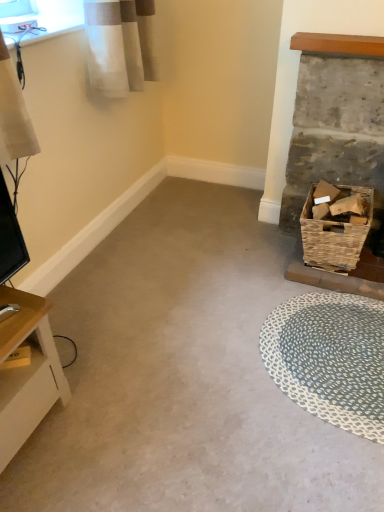
The height and width of the screenshot is (512, 384). I want to click on woven brown basket at right, so click(334, 234).

This screenshot has width=384, height=512. What do you see at coordinates (334, 234) in the screenshot?
I see `woven brown basket at right` at bounding box center [334, 234].

Describe the element at coordinates (337, 153) in the screenshot. I see `rustic wicker basket at right` at that location.

The image size is (384, 512). What are the coordinates of `woven brown basket at right` in the screenshot? It's located at (334, 234).

Which of these two, rustic wicker basket at right or light wood table at lower left, is wider?

Wider between the two is light wood table at lower left.

Who is smaller, rustic wicker basket at right or light wood table at lower left?

With smaller size is rustic wicker basket at right.

In the scene shown: Considering the relative positions of rustic wicker basket at right and light wood table at lower left in the image provided, is rustic wicker basket at right to the left or to the right of light wood table at lower left?

rustic wicker basket at right is positioned on light wood table at lower left's right side.

From the image's perspective, between rustic wicker basket at right and light wood table at lower left, who is located below?

light wood table at lower left appears lower in the image.

From the picture: Can we say woven brown basket at right lies outside blue woven mat at lower right?

Indeed, woven brown basket at right is completely outside blue woven mat at lower right.

Which is further, (368, 188) or (380, 393)?

Positioned behind is point (368, 188).

Considering the sizes of woven brown basket at right and blue woven mat at lower right in the image, is woven brown basket at right bigger or smaller than blue woven mat at lower right?

woven brown basket at right is bigger than blue woven mat at lower right.

Could you tell me if light wood table at lower left is facing rustic wicker basket at right?

No, light wood table at lower left is not turned towards rustic wicker basket at right.

Looking at their sizes, would you say light wood table at lower left is wider or thinner than rustic wicker basket at right?

Considering their sizes, light wood table at lower left looks broader than rustic wicker basket at right.

Considering the relative positions of light wood table at lower left and rustic wicker basket at right in the image provided, is light wood table at lower left to the right of rustic wicker basket at right from the viewer's perspective?

No.

Measure the distance from light wood table at lower left to rustic wicker basket at right.

light wood table at lower left is 1.31 meters from rustic wicker basket at right.

Considering the sizes of objects blue woven mat at lower right and woven brown basket at right in the image provided, who is wider, blue woven mat at lower right or woven brown basket at right?

Wider between the two is blue woven mat at lower right.

Between blue woven mat at lower right and woven brown basket at right, which one appears on the right side from the viewer's perspective?

Positioned to the right is woven brown basket at right.

Considering the relative sizes of blue woven mat at lower right and woven brown basket at right in the image provided, is blue woven mat at lower right shorter than woven brown basket at right?

Correct, blue woven mat at lower right is not as tall as woven brown basket at right.

Considering the relative positions of woven brown basket at right and light wood table at lower left in the image provided, is woven brown basket at right behind light wood table at lower left?

Yes, woven brown basket at right is further from the viewer.

From the image's perspective, who appears lower, woven brown basket at right or light wood table at lower left?

light wood table at lower left, from the image's perspective.

Considering the points (316, 222) and (33, 304), which point is behind, point (316, 222) or point (33, 304)?

The point (316, 222) is behind.

Does woven brown basket at right have a lesser width compared to light wood table at lower left?

Yes, woven brown basket at right is thinner than light wood table at lower left.

From the image's perspective, who appears lower, blue woven mat at lower right or light wood table at lower left?

light wood table at lower left, from the image's perspective.

Who is smaller, blue woven mat at lower right or light wood table at lower left?

Smaller between the two is blue woven mat at lower right.

Find the location of a particular element. table in front of the blue woven mat at lower right is located at coordinates (27, 372).

Is blue woven mat at lower right positioned far away from light wood table at lower left?

No, blue woven mat at lower right is not far away from light wood table at lower left.

From the image's perspective, relative to blue woven mat at lower right, is light wood table at lower left above or below?

Clearly, from the image's perspective, light wood table at lower left is below blue woven mat at lower right.

Considering the positions of point (33, 319) and point (344, 406), is point (33, 319) closer or farther from the camera than point (344, 406)?

Point (33, 319) is positioned closer to the camera compared to point (344, 406).

Considering the sizes of light wood table at lower left and blue woven mat at lower right in the image, is light wood table at lower left taller or shorter than blue woven mat at lower right?

light wood table at lower left is taller than blue woven mat at lower right.

Find the location of a particular element. This screenshot has height=512, width=384. fireplace behind the light wood table at lower left is located at coordinates (337, 153).

This screenshot has width=384, height=512. Find the location of `basket on the right of the blue woven mat at lower right`. basket on the right of the blue woven mat at lower right is located at coordinates (334, 234).

From the image, which object appears to be farther from woven brown basket at right, rustic wicker basket at right or blue woven mat at lower right?

blue woven mat at lower right is further to woven brown basket at right.

In the scene shown: Considering their positions, is light wood table at lower left positioned further to blue woven mat at lower right than woven brown basket at right?

light wood table at lower left lies further to blue woven mat at lower right than the other object.

Which object lies nearer to the anchor point rustic wicker basket at right, blue woven mat at lower right or light wood table at lower left?

Based on the image, blue woven mat at lower right appears to be nearer to rustic wicker basket at right.

In the scene shown: Based on their spatial positions, is rustic wicker basket at right or blue woven mat at lower right closer to light wood table at lower left?

Based on the image, blue woven mat at lower right appears to be nearer to light wood table at lower left.

From the image, which object appears to be nearer to rustic wicker basket at right, woven brown basket at right or light wood table at lower left?

woven brown basket at right lies closer to rustic wicker basket at right than the other object.

Based on their spatial positions, is blue woven mat at lower right or rustic wicker basket at right further from woven brown basket at right?

blue woven mat at lower right.

Estimate the real-world distances between objects in this image. Which object is further from rustic wicker basket at right, light wood table at lower left or woven brown basket at right?

light wood table at lower left.

Estimate the real-world distances between objects in this image. Which object is further from woven brown basket at right, light wood table at lower left or rustic wicker basket at right?

light wood table at lower left is positioned further to the anchor woven brown basket at right.

This screenshot has height=512, width=384. In order to click on basket between light wood table at lower left and rustic wicker basket at right in the horizontal direction in this screenshot , I will do `click(334, 234)`.

I want to click on mat situated between light wood table at lower left and rustic wicker basket at right from left to right, so click(x=330, y=358).

The width and height of the screenshot is (384, 512). Identify the location of mat located between light wood table at lower left and woven brown basket at right in the left-right direction. (330, 358).

I want to click on basket between rustic wicker basket at right and blue woven mat at lower right in the vertical direction, so click(334, 234).